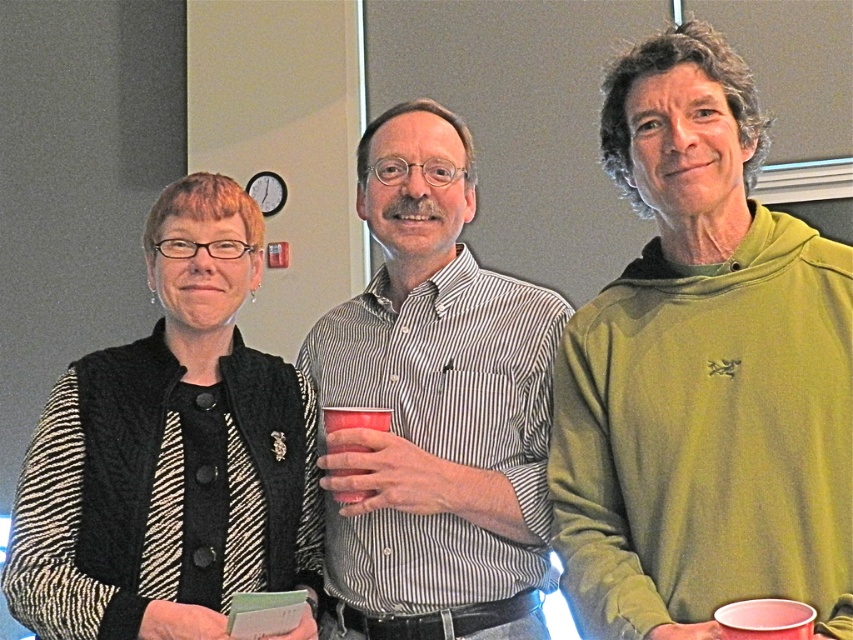
Does white striped shirt at center have a lesser width compared to matte plastic cup at center?

Incorrect, white striped shirt at center's width is not less than matte plastic cup at center's.

Who is taller, white striped shirt at center or matte plastic cup at center?

white striped shirt at center

Locate an element on the screen. The image size is (853, 640). white striped shirt at center is located at coordinates (434, 406).

Find the location of `white striped shirt at center`. white striped shirt at center is located at coordinates [x=434, y=406].

Who is shorter, green hoodie at center or matte plastic cup at center?

Standing shorter between the two is matte plastic cup at center.

Consider the image. Measure the distance between green hoodie at center and matte plastic cup at center.

green hoodie at center and matte plastic cup at center are 16.55 inches apart from each other.

Which is in front, point (746, 380) or point (349, 420)?

Positioned in front is point (746, 380).

Locate an element on the screen. green hoodie at center is located at coordinates coord(701,372).

Does green hoodie at center have a lesser width compared to black knitted vest at left?

Yes, green hoodie at center is thinner than black knitted vest at left.

Can you confirm if green hoodie at center is positioned above black knitted vest at left?

Correct, green hoodie at center is located above black knitted vest at left.

Does point (653, 529) come behind point (36, 486)?

No, it is in front of (36, 486).

Where is `green hoodie at center`? The width and height of the screenshot is (853, 640). green hoodie at center is located at coordinates (701, 372).